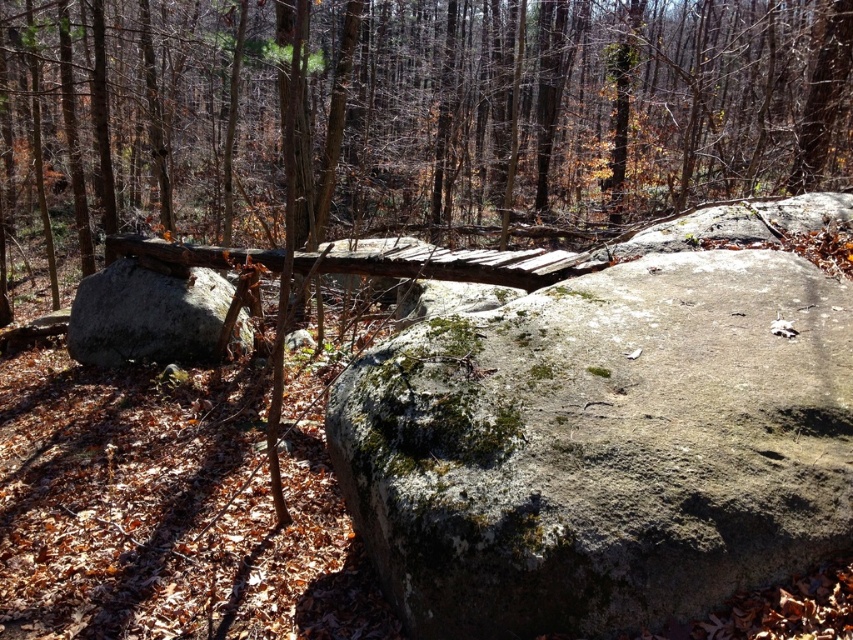
Question: Can you confirm if green mossy rock at center is bigger than brown wooden bridge at center?

Choices:
 (A) no
 (B) yes

Answer: (B)

Question: Which of the following is the closest to the observer?

Choices:
 (A) brown wooden bridge at center
 (B) green mossy rock at center
 (C) gray mossy rock at left
 (D) brown rough log at center

Answer: (B)

Question: Which point is closer to the camera?

Choices:
 (A) (729, 13)
 (B) (157, 273)
 (C) (637, 589)
 (D) (339, 260)

Answer: (C)

Question: Is brown rough log at center wider than gray mossy rock at left?

Choices:
 (A) no
 (B) yes

Answer: (B)

Question: Which object is positioned farthest from the gray mossy rock at left?

Choices:
 (A) brown rough log at center
 (B) brown wooden bridge at center
 (C) green mossy rock at center

Answer: (A)

Question: Is green mossy rock at center smaller than brown wooden bridge at center?

Choices:
 (A) no
 (B) yes

Answer: (A)